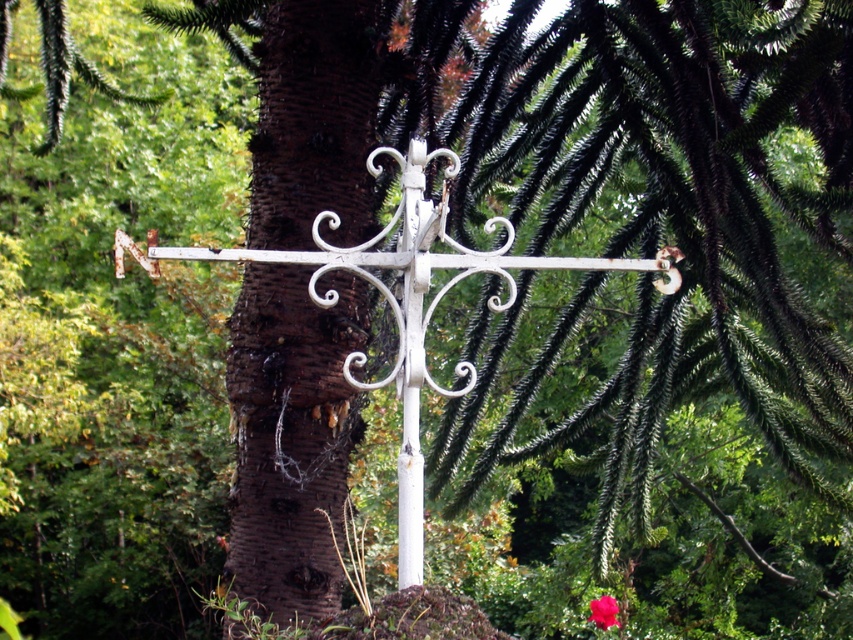
Does brown rough bark at center have a larger size compared to smooth pink rose at center?

Yes, brown rough bark at center is bigger than smooth pink rose at center.

Is brown rough bark at center to the right of smooth pink rose at center from the viewer's perspective?

Incorrect, brown rough bark at center is not on the right side of smooth pink rose at center.

Is point (334, 572) farther from viewer compared to point (610, 609)?

No, (334, 572) is in front of (610, 609).

I want to click on brown rough bark at center, so click(289, 436).

Which is above, brown rough bark at center or white wrought iron cross at center?

brown rough bark at center is higher up.

Is brown rough bark at center smaller than white wrought iron cross at center?

Correct, brown rough bark at center occupies less space than white wrought iron cross at center.

Is point (312, 93) positioned after point (440, 268)?

Yes, it is behind point (440, 268).

At what (x,y) coordinates should I click in order to perform the action: click on brown rough bark at center. Please return your answer as a coordinate pair (x, y). Image resolution: width=853 pixels, height=640 pixels. Looking at the image, I should click on (289, 436).

Can you confirm if white wrought iron cross at center is wider than smooth pink rose at center?

Yes.

Is white wrought iron cross at center behind smooth pink rose at center?

No, it is in front of smooth pink rose at center.

Who is more forward, [456,241] or [607,612]?

Point [456,241]

Find the location of a particular element. Image resolution: width=853 pixels, height=640 pixels. white wrought iron cross at center is located at coordinates (405, 301).